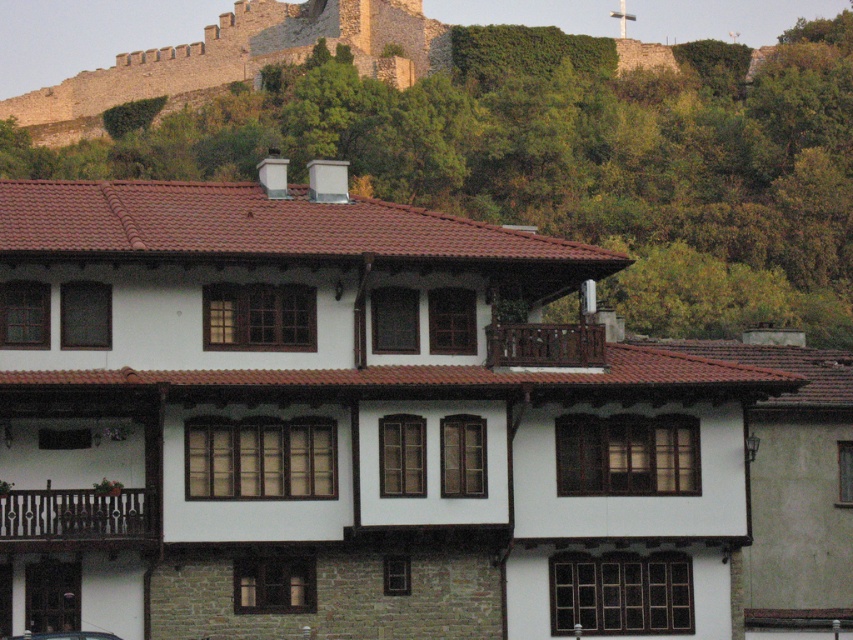
Consider the image. You are a delivery driver approaching the two story building and see the brown stone wall at upper center and the metallic silver car at lower left. Which object is higher in elevation?

The brown stone wall at upper center is much taller than the metallic silver car at lower left, so it is higher in elevation.

You are standing in front of the two story building and want to walk from point (x=430, y=51) to point (x=12, y=636). Which point will you reach first?

You will reach point (x=12, y=636) first because it is closer to you than point (x=430, y=51), which is further away.

You are a delivery driver approaching the two story building and need to park your metallic silver car at lower left. There is a brown stone wall at upper center that might block your path. Can you drive straight towards the building without any obstacles?

The brown stone wall at upper center is positioned over the metallic silver car at lower left, so driving straight towards the building would not be blocked by the wall since it is above the car.